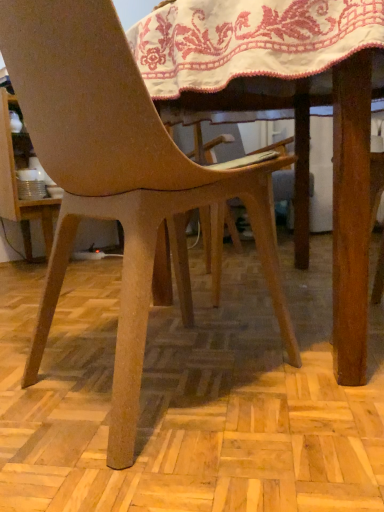
In order to face wooden chair at center, should I rotate leftwards or rightwards?

It's best to rotate left around 5.430 degrees.

What do you see at coordinates (116, 175) in the screenshot?
I see `wooden chair at center` at bounding box center [116, 175].

Locate an element on the screen. wooden chair at center is located at coordinates (116, 175).

The width and height of the screenshot is (384, 512). Identify the location of wooden chair at center. (116, 175).